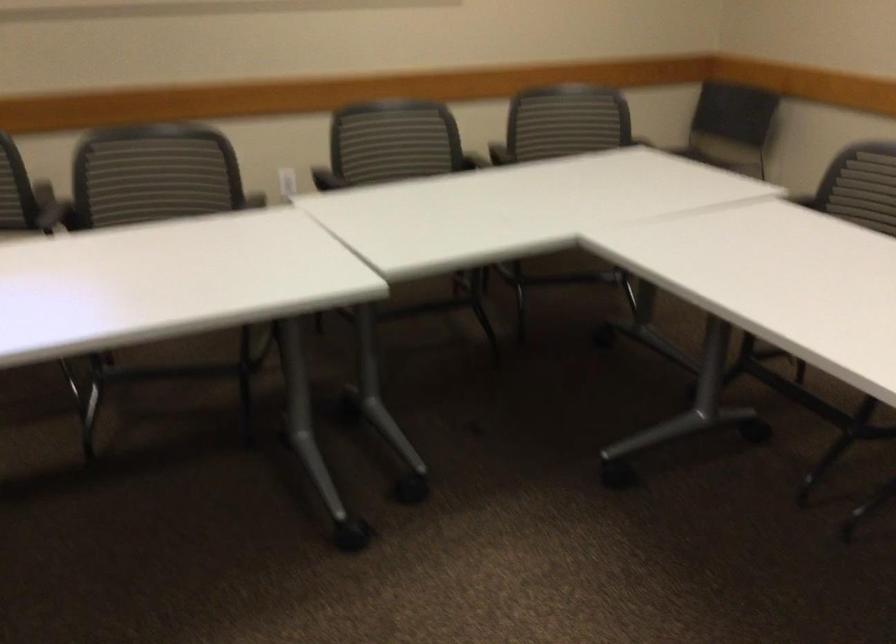
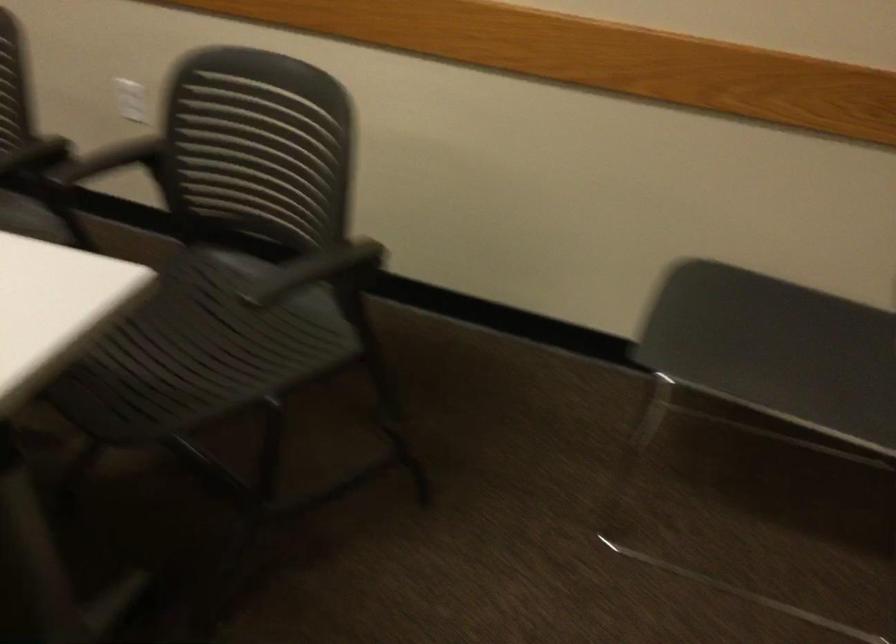
In the second image, find the point that corresponds to point 681,156 in the first image.

(714, 323)